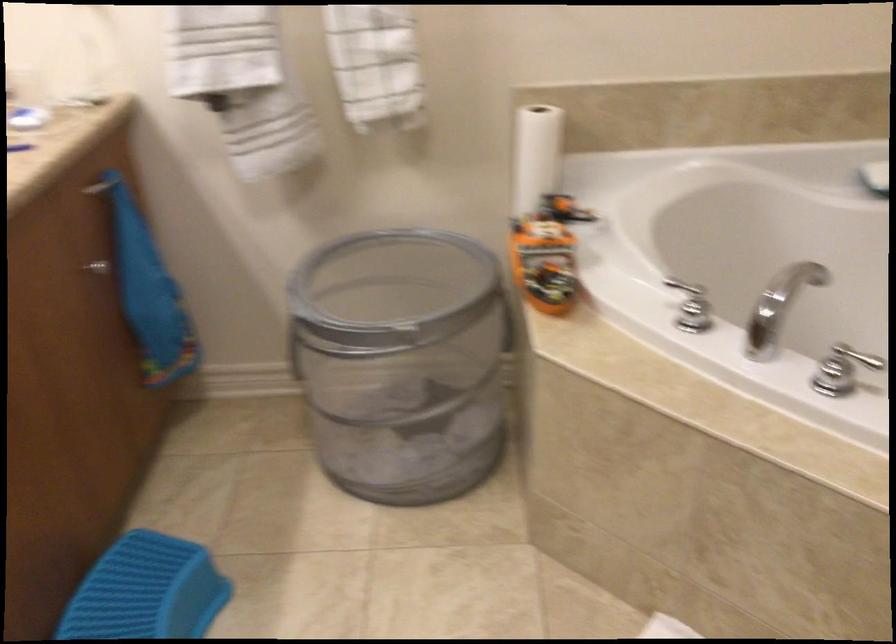
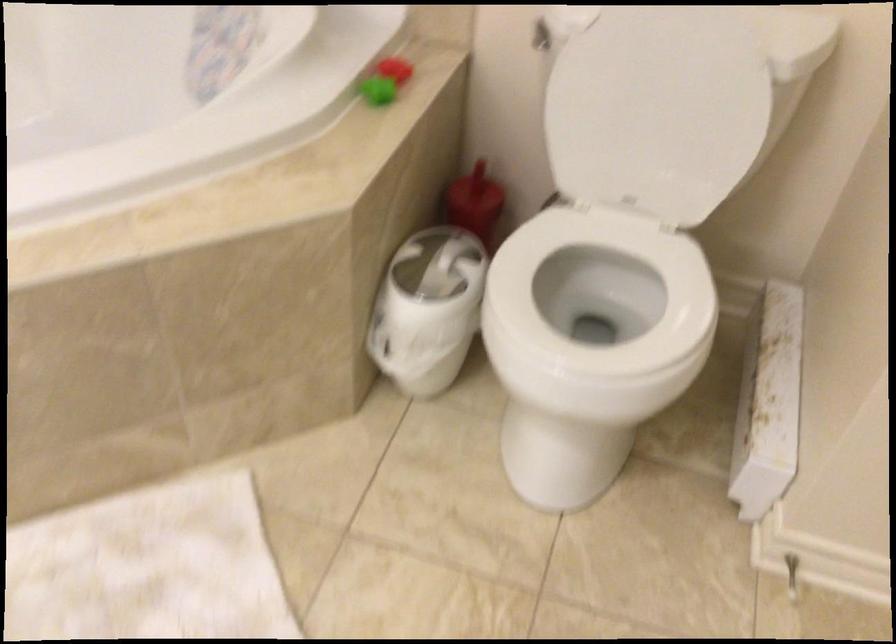
The first image is from the beginning of the video and the second image is from the end. How did the camera likely rotate when shooting the video?

The camera's rotation is toward right-down.